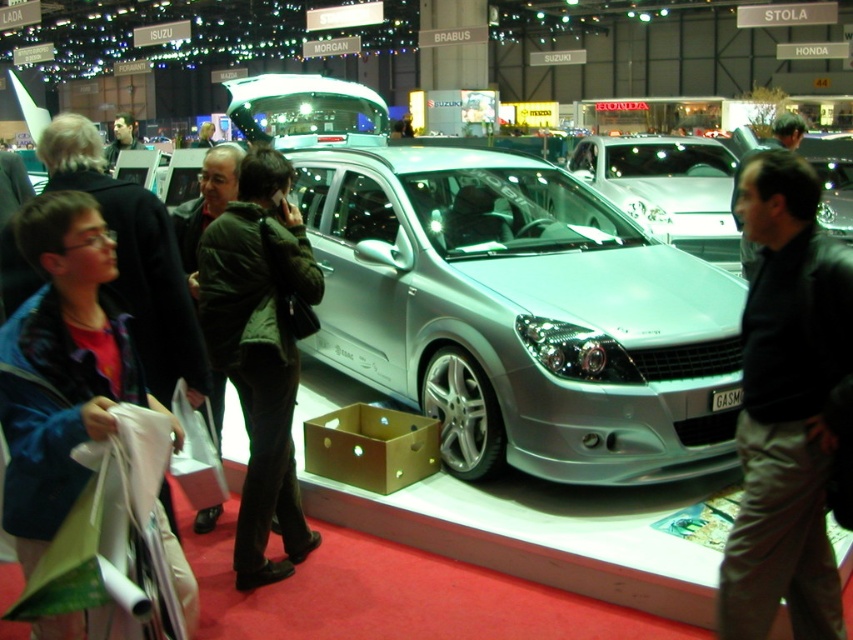
Question: Is green corduroy jacket at center in front of dark green jacket at center?

Choices:
 (A) yes
 (B) no

Answer: (A)

Question: Which of the following is the closest to the observer?

Choices:
 (A) (798, 326)
 (B) (659, 365)
 (C) (137, 140)
 (D) (19, 326)

Answer: (D)

Question: Which of these objects is positioned farthest from the black leather jacket at center?

Choices:
 (A) blue denim jacket at lower left
 (B) dark green jacket at center
 (C) green corduroy jacket at center

Answer: (B)

Question: Estimate the real-world distances between objects in this image. Which object is closer to the black leather jacket at center?

Choices:
 (A) silver metallic car at center
 (B) blue denim jacket at lower left
 (C) dark green jacket at center
 (D) green corduroy jacket at center

Answer: (D)

Question: From the image, what is the correct spatial relationship of silver metallic car at center in relation to green corduroy jacket at center?

Choices:
 (A) left
 (B) right

Answer: (B)

Question: Does blue denim jacket at lower left have a greater width compared to green corduroy jacket at center?

Choices:
 (A) yes
 (B) no

Answer: (B)